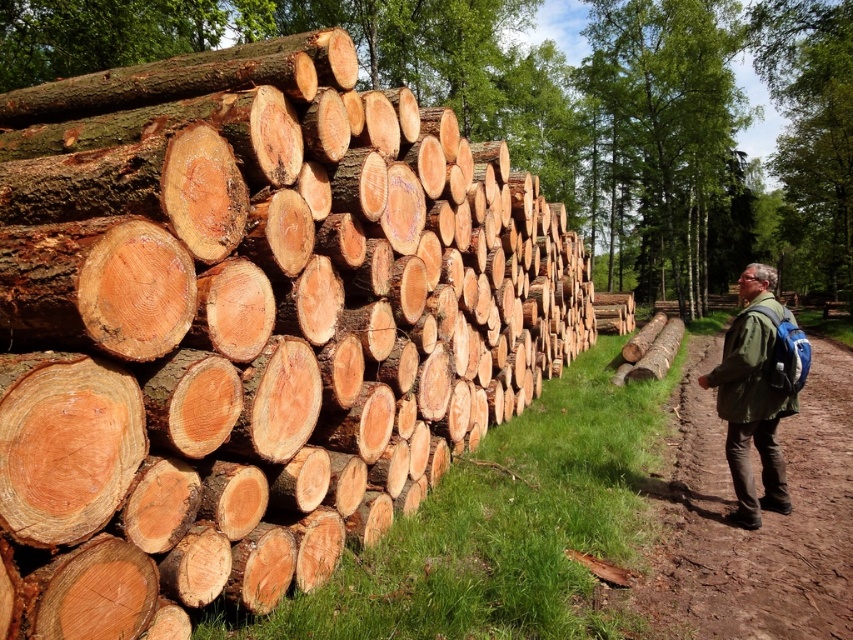
Question: Is natural wood logs at left closer to camera compared to green leafy tree at upper center?

Choices:
 (A) no
 (B) yes

Answer: (B)

Question: Does natural wood logs at left lie in front of brown dirt track at right?

Choices:
 (A) yes
 (B) no

Answer: (A)

Question: Which point is farther to the camera?

Choices:
 (A) green leafy tree at upper center
 (B) brown dirt track at right
 (C) natural wood logs at left
 (D) green fabric jacket at right

Answer: (A)

Question: Does green leafy tree at upper center appear on the left side of green fabric jacket at right?

Choices:
 (A) yes
 (B) no

Answer: (B)

Question: Which point appears closest to the camera in this image?

Choices:
 (A) (207, 362)
 (B) (778, 429)
 (C) (735, 353)
 (D) (666, 13)

Answer: (A)

Question: Which of the following is the closest to the observer?

Choices:
 (A) green fabric jacket at right
 (B) brown dirt track at right
 (C) natural wood logs at left

Answer: (C)